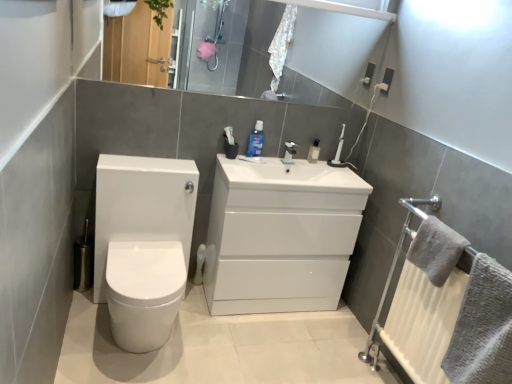
Find the location of a particular element. The width and height of the screenshot is (512, 384). free area in between transparent plastic bottle at upper center, the 1th mouthwash when ordered from right to left, and matte silver faucet at upper center is located at coordinates (300, 156).